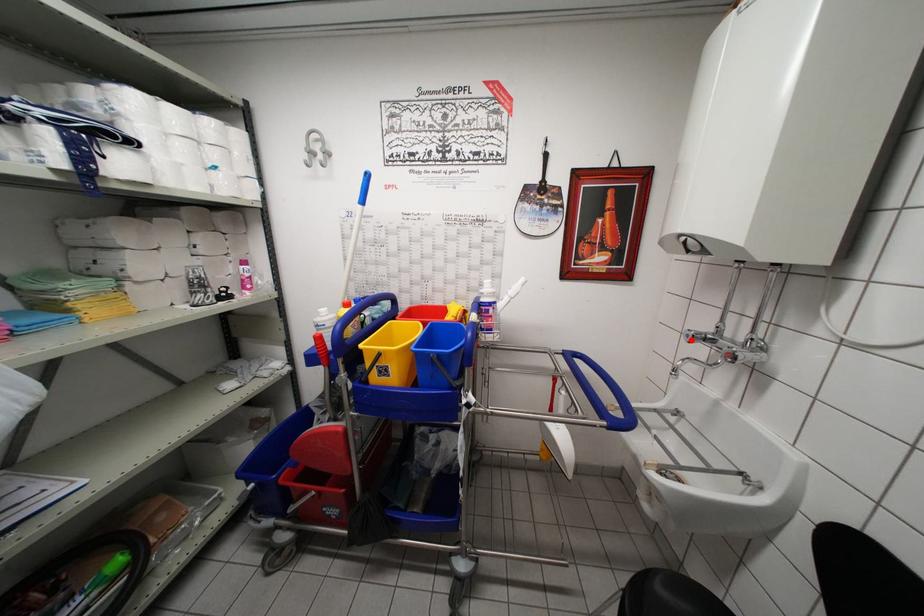
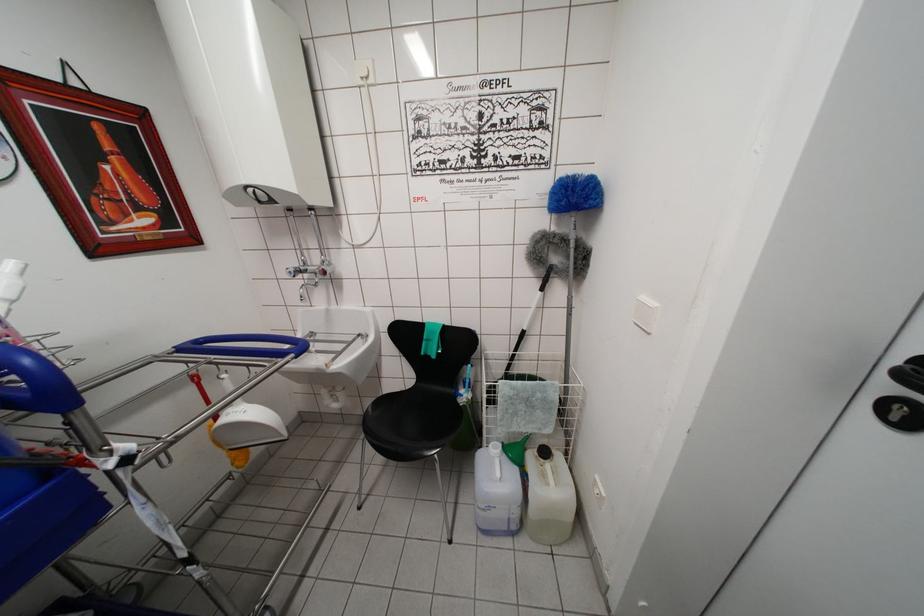
Find the pixel in the second image that matches the highlighted location in the first image.

(293, 277)